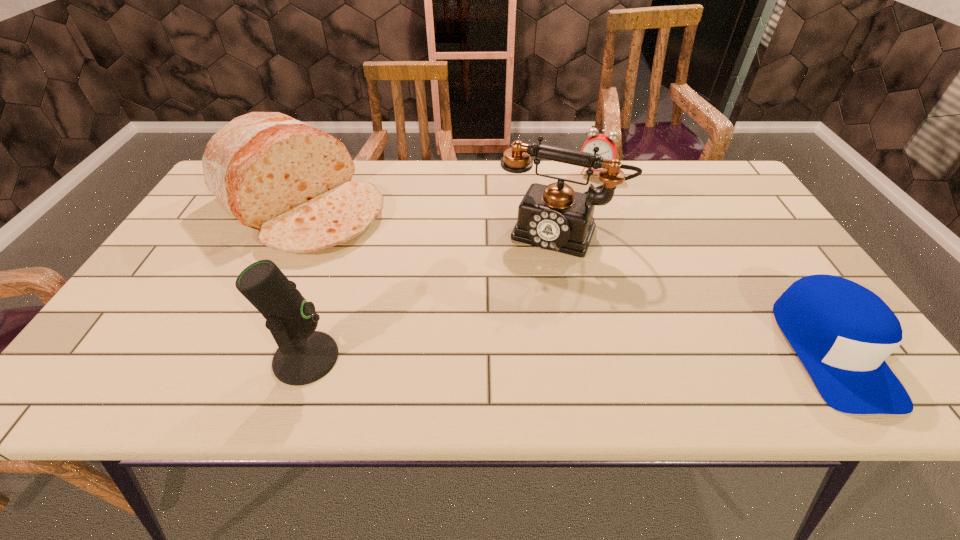
What are the coordinates of `object positioned at the right edge` in the screenshot? It's located at (842, 332).

Identify the location of object present at the far left corner. (292, 182).

You are a GUI agent. You are given a task and a screenshot of the screen. Output one action in this format:
    pyautogui.click(x=<x>, y=<y>)
    Task: Click on the object that is at the near right corner
    Image resolution: width=960 pixels, height=540 pixels.
    Given the screenshot: What is the action you would take?
    pyautogui.click(x=842, y=332)

Image resolution: width=960 pixels, height=540 pixels. What are the coordinates of `free space at the far edge of the desktop` in the screenshot? It's located at (482, 164).

In the image, there is a desktop. Where is `vacant space at the near edge`? This screenshot has width=960, height=540. vacant space at the near edge is located at coordinates (187, 343).

Identify the location of blank space at the left edge of the desktop. (228, 246).

The image size is (960, 540). I want to click on blank space at the right edge of the desktop, so click(x=759, y=271).

Identify the location of free space between the rightmost object and the alarm clock. This screenshot has width=960, height=540. (712, 261).

Where is `vacant area that lies between the bread and the microphone`? vacant area that lies between the bread and the microphone is located at coordinates (304, 281).

Locate an element on the screen. The image size is (960, 540). free space that is in between the rightmost object and the alarm clock is located at coordinates (712, 261).